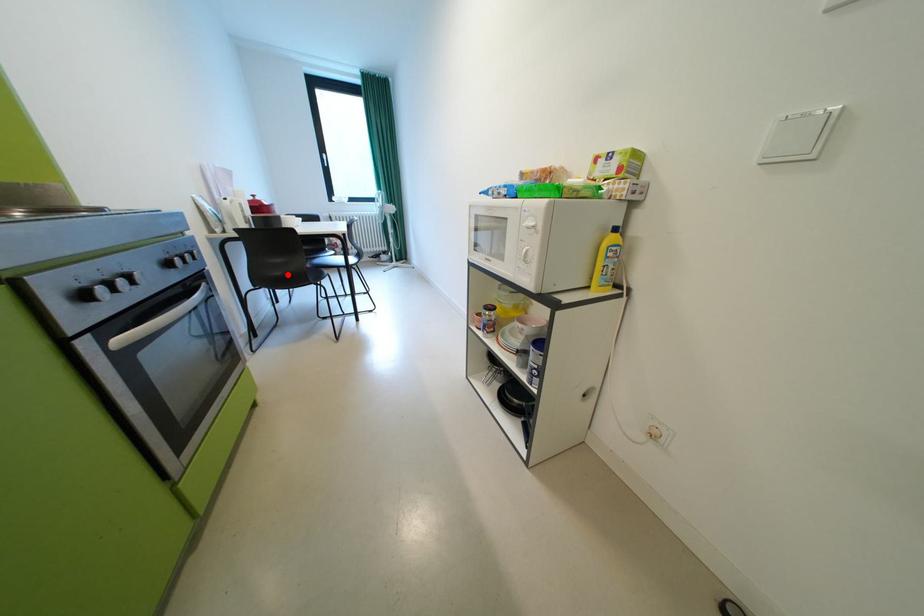
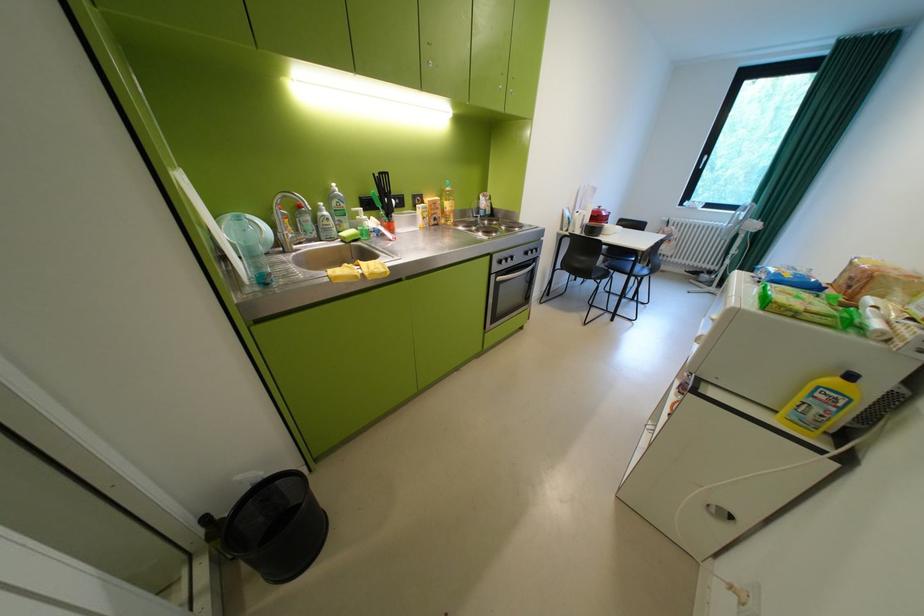
Question: I am providing you with two images of the same scene from different viewpoints. In image1, a red point is highlighted. Considering the same 3D point in image2, which of the following is correct?

Choices:
 (A) It is closer
 (B) It is farther

Answer: (A)